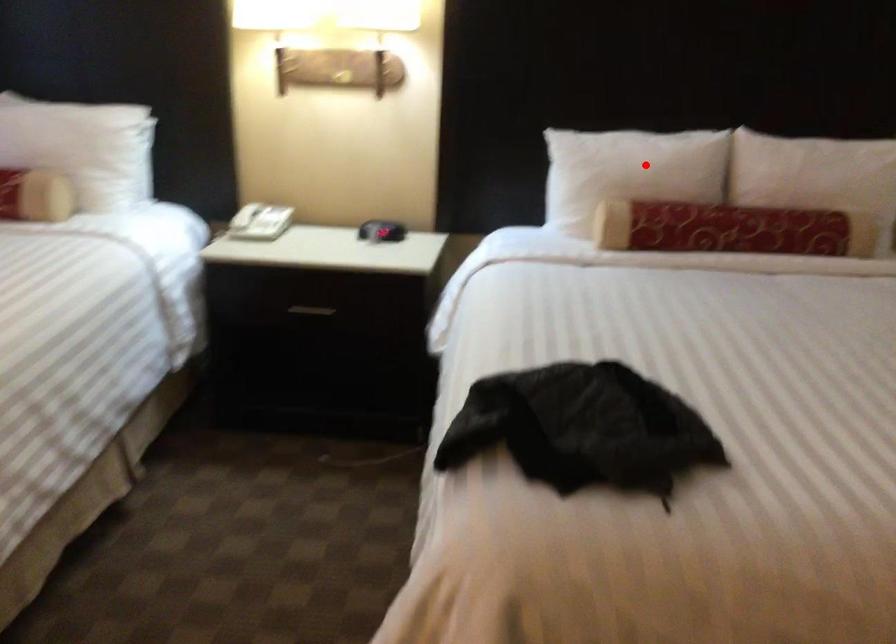
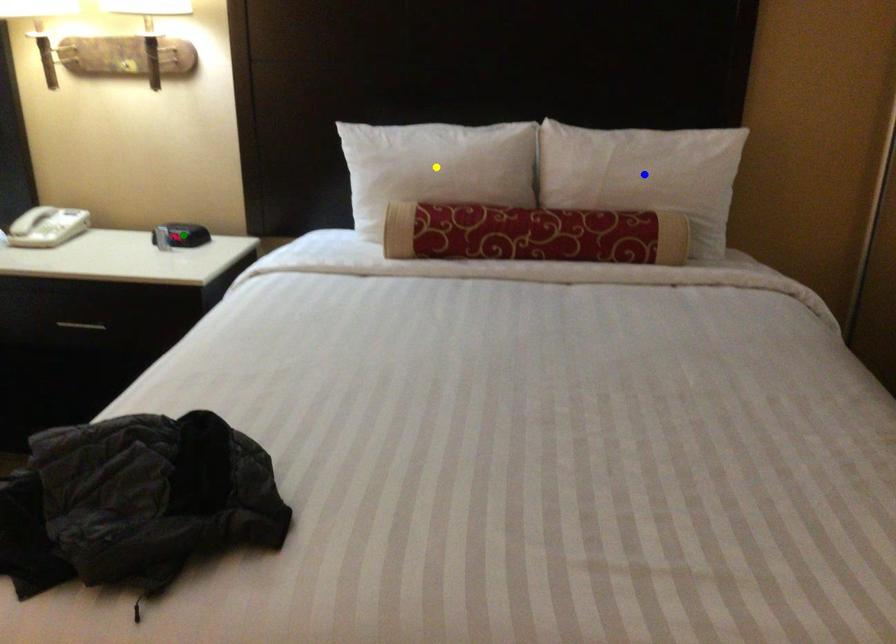
Question: I am providing you with two images of the same scene from different viewpoints. A red point is marked on the first image. You are given multiple points on the second image. Which mark in image 2 goes with the point in image 1?

Choices:
 (A) green point
 (B) blue point
 (C) yellow point

Answer: (C)